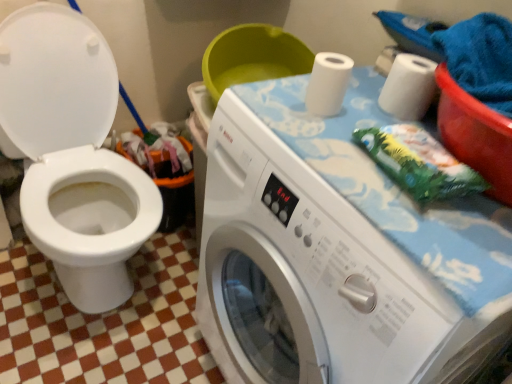
I want to click on vacant space in between white matte toilet paper at upper right, the 2th toilet paper in the right-to-left sequence, and green fabric at upper right, so click(x=348, y=134).